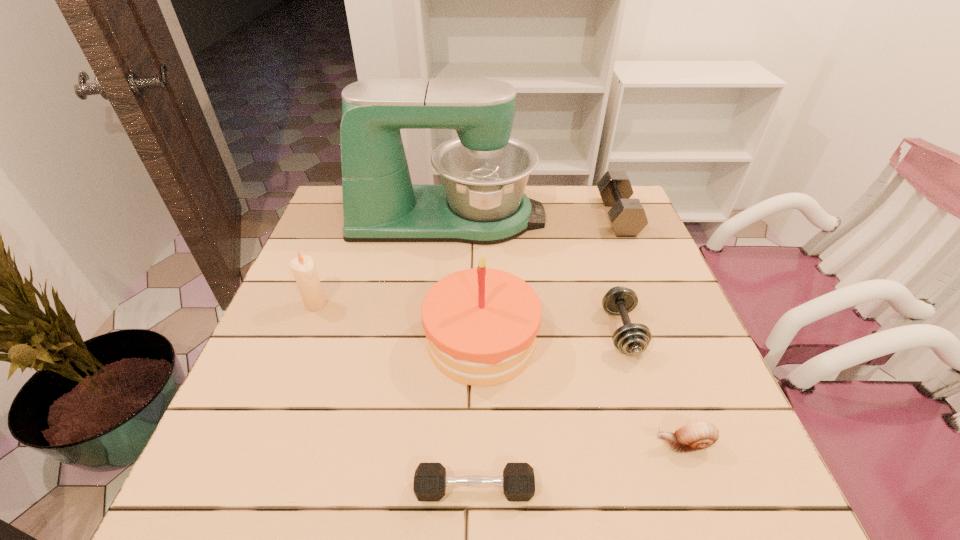
Locate an element on the screen. This screenshot has height=540, width=960. free location at the left edge of the desktop is located at coordinates (319, 272).

Identify the location of vacant space at the right edge. [658, 313].

Where is `vacant space at the far left corner of the desktop`? vacant space at the far left corner of the desktop is located at coordinates (320, 221).

At what (x,y) coordinates should I click in order to perform the action: click on free space at the far right corner of the desktop. Please return your answer as a coordinate pair (x, y). Looking at the image, I should click on (599, 202).

Identify the location of vacant area that lies between the farthest dumbbell and the second tallest object. The image size is (960, 540). (549, 279).

At what (x,y) coordinates should I click in order to perform the action: click on vacant region between the birthday cake and the sixth farthest object. Please return your answer as a coordinate pair (x, y). The width and height of the screenshot is (960, 540). Looking at the image, I should click on point(582,393).

This screenshot has height=540, width=960. In order to click on vacant space that's between the escargot and the second tallest object in this screenshot , I will do pos(582,393).

You are a GUI agent. You are given a task and a screenshot of the screen. Output one action in this format:
    pyautogui.click(x=<x>, y=<y>)
    Task: Click on the vacant space in between the birthday cake and the nearest object
    
    Given the screenshot: What is the action you would take?
    pyautogui.click(x=478, y=415)

The width and height of the screenshot is (960, 540). In order to click on empty space between the tallest object and the third shortest object in this screenshot , I will do `click(535, 274)`.

The image size is (960, 540). I want to click on free area in between the farthest dumbbell and the birthday cake, so click(x=549, y=279).